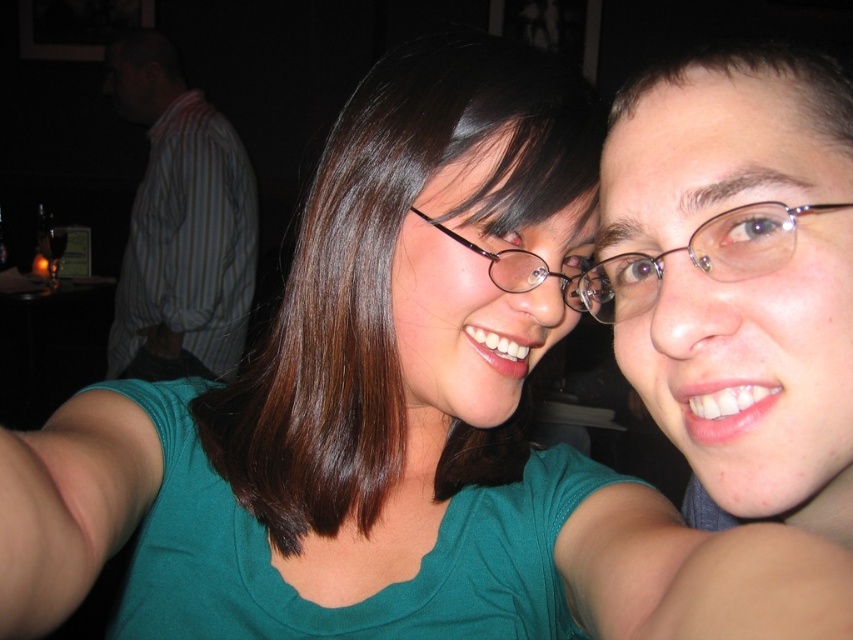
Which of these two, striped shirt at upper left or matte black glasses at center, stands shorter?

matte black glasses at center is shorter.

Which is behind, point (228, 260) or point (519, 248)?

Point (228, 260)

The image size is (853, 640). What do you see at coordinates (180, 225) in the screenshot?
I see `striped shirt at upper left` at bounding box center [180, 225].

Identify the location of striped shirt at upper left. This screenshot has width=853, height=640. (x=180, y=225).

Is clear plastic glasses at center to the right of brown hair at upper right from the viewer's perspective?

Incorrect, clear plastic glasses at center is not on the right side of brown hair at upper right.

Is clear plastic glasses at center above brown hair at upper right?

Actually, clear plastic glasses at center is below brown hair at upper right.

Locate an element on the screen. clear plastic glasses at center is located at coordinates (697, 257).

Who is taller, pink flesh at lower right or clear plastic glasses at center?

pink flesh at lower right is taller.

Does pink flesh at lower right have a greater width compared to clear plastic glasses at center?

No.

Does point (773, 529) come farther from viewer compared to point (746, 250)?

That is False.

Identify the location of pink flesh at lower right. (695, 573).